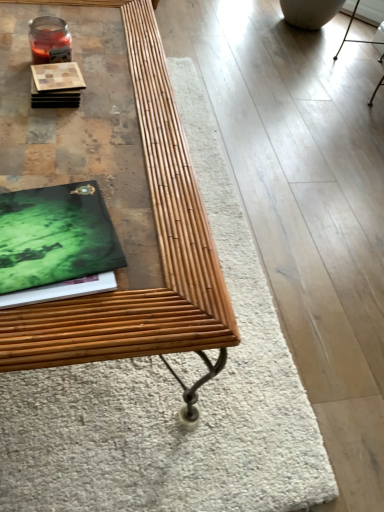
Locate an element on the screen. This screenshot has width=384, height=512. vacant area on the back side of green matte book at left is located at coordinates (84, 152).